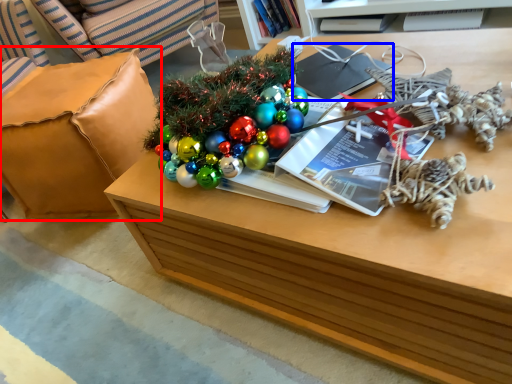
Question: Which object appears closest to the camera in this image, armchair (highlighted by a red box) or magazine (highlighted by a blue box)?

Choices:
 (A) armchair
 (B) magazine

Answer: (B)